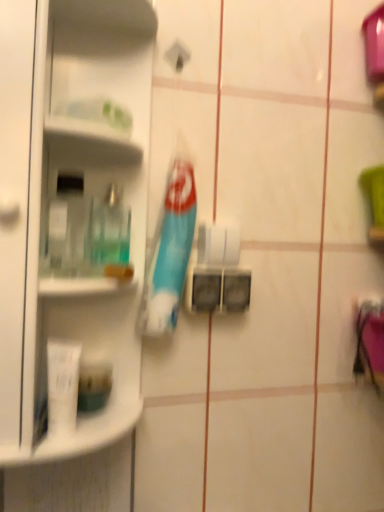
Question: Considering the relative sizes of white matte toilet paper at center and blue plastic toothbrush at center in the image provided, is white matte toilet paper at center shorter than blue plastic toothbrush at center?

Choices:
 (A) no
 (B) yes

Answer: (B)

Question: From the image's perspective, does white matte toilet paper at center appear higher than blue plastic toothbrush at center?

Choices:
 (A) no
 (B) yes

Answer: (A)

Question: Is white matte toilet paper at center thinner than blue plastic toothbrush at center?

Choices:
 (A) yes
 (B) no

Answer: (A)

Question: Considering the relative positions of white matte toilet paper at center and blue plastic toothbrush at center in the image provided, is white matte toilet paper at center in front of blue plastic toothbrush at center?

Choices:
 (A) yes
 (B) no

Answer: (B)

Question: Is white matte toilet paper at center at the left side of blue plastic toothbrush at center?

Choices:
 (A) yes
 (B) no

Answer: (B)

Question: In terms of size, does blue plastic toothbrush at center appear bigger or smaller than white glossy shelf at upper left?

Choices:
 (A) big
 (B) small

Answer: (B)

Question: Is point (155, 302) positioned closer to the camera than point (130, 154)?

Choices:
 (A) farther
 (B) closer

Answer: (B)

Question: Which is correct: blue plastic toothbrush at center is inside white glossy shelf at upper left, or outside of it?

Choices:
 (A) inside
 (B) outside

Answer: (B)

Question: Considering the positions of blue plastic toothbrush at center and white glossy shelf at upper left in the image, is blue plastic toothbrush at center wider or thinner than white glossy shelf at upper left?

Choices:
 (A) thin
 (B) wide

Answer: (A)

Question: In terms of height, does clear plastic bottle at left look taller or shorter compared to white glossy shelf at upper left?

Choices:
 (A) tall
 (B) short

Answer: (B)

Question: Is clear plastic bottle at left situated inside white glossy shelf at upper left or outside?

Choices:
 (A) inside
 (B) outside

Answer: (A)

Question: Considering the positions of clear plastic bottle at left and white glossy shelf at upper left in the image, is clear plastic bottle at left bigger or smaller than white glossy shelf at upper left?

Choices:
 (A) big
 (B) small

Answer: (B)

Question: From the image's perspective, is clear plastic bottle at left located above or below white glossy shelf at upper left?

Choices:
 (A) below
 (B) above

Answer: (A)

Question: Is point (46, 349) closer or farther from the camera than point (180, 258)?

Choices:
 (A) farther
 (B) closer

Answer: (B)

Question: Choose the correct answer: Is white matte tube at lower left, the second toiletry in the back-to-front sequence, inside blue plastic toothbrush at center or outside it?

Choices:
 (A) outside
 (B) inside

Answer: (A)